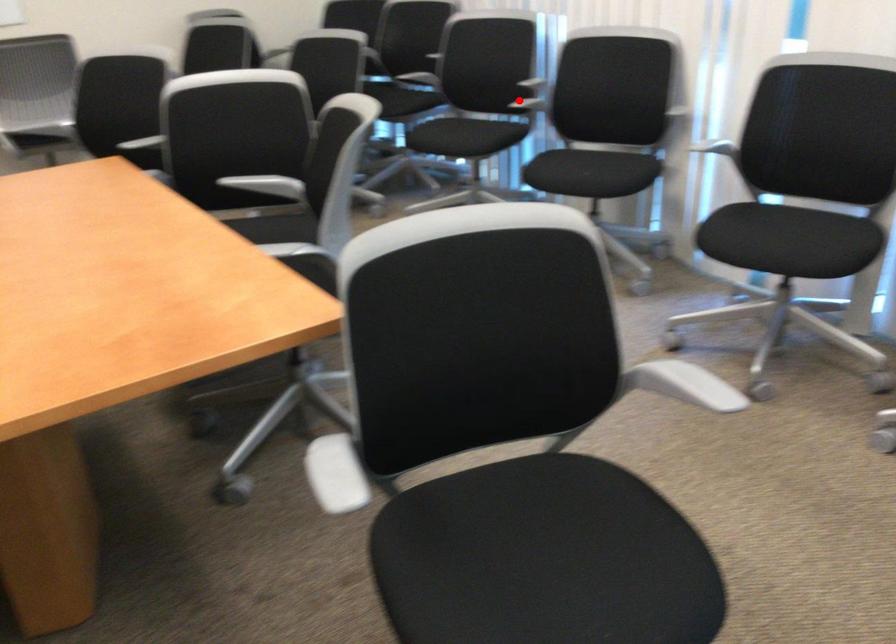
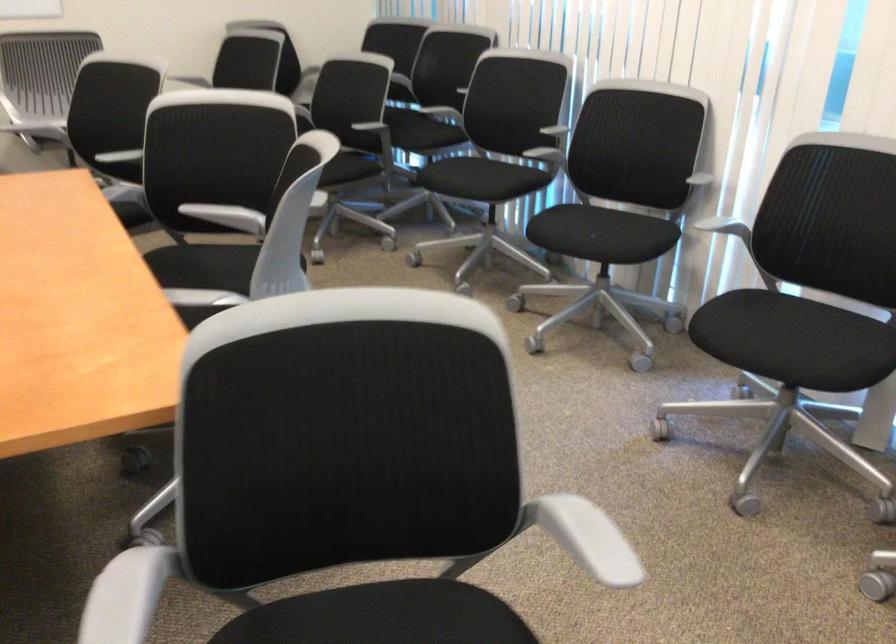
In the second image, find the point that corresponds to the highlighted location in the first image.

(543, 146)